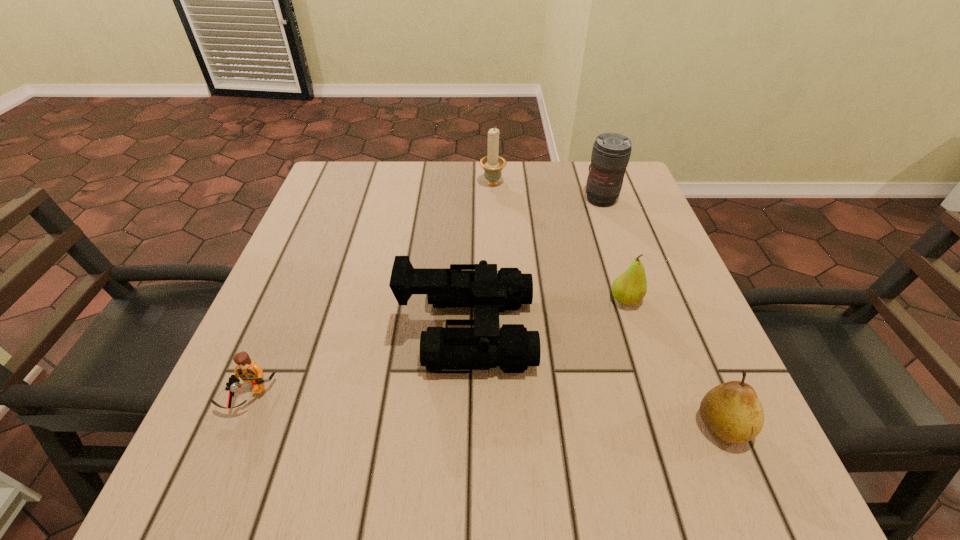
Identify the location of free space located on the back of the right pear. Image resolution: width=960 pixels, height=540 pixels. (646, 244).

Locate an element on the screen. free space located 0.120m holding a crossbow in the hands of the leftmost object is located at coordinates (207, 497).

You are a GUI agent. You are given a task and a screenshot of the screen. Output one action in this format:
    pyautogui.click(x=<x>, y=<y>)
    Task: Click on the telephoto lens at the far edge
    The image size is (960, 540).
    Given the screenshot: What is the action you would take?
    pyautogui.click(x=611, y=152)

Identify the location of candle_holder at the far edge. This screenshot has height=540, width=960. (492, 164).

At what (x,y) coordinates should I click in order to perform the action: click on object at the near edge. Please return your answer as a coordinate pair (x, y). Looking at the image, I should click on (732, 411).

Where is `object that is at the left edge`? The image size is (960, 540). object that is at the left edge is located at coordinates (247, 370).

You are a GUI agent. You are given a task and a screenshot of the screen. Output one action in this format:
    pyautogui.click(x=<x>, y=<y>)
    Task: Click on the telephoto lens that is positioned at the right edge
    This screenshot has height=540, width=960.
    Given the screenshot: What is the action you would take?
    pyautogui.click(x=611, y=152)

Where is `object that is at the far right corner`? The height and width of the screenshot is (540, 960). object that is at the far right corner is located at coordinates (611, 152).

Identify the location of object that is at the near right corner. This screenshot has width=960, height=540. (732, 411).

Where is `free space at the far edge of the desktop`? Image resolution: width=960 pixels, height=540 pixels. free space at the far edge of the desktop is located at coordinates (394, 178).